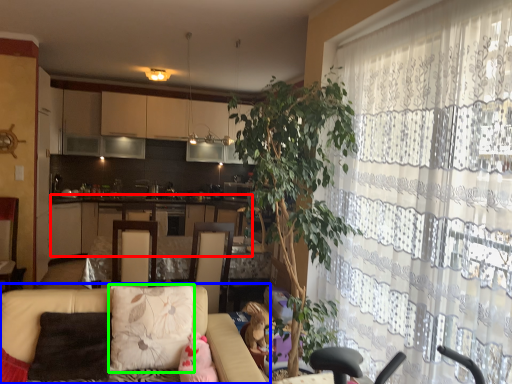
Question: Estimate the real-world distances between objects in this image. Which object is closer to cabinetry (highlighted by a red box), studio couch (highlighted by a blue box) or pillow (highlighted by a green box)?

Choices:
 (A) studio couch
 (B) pillow

Answer: (B)